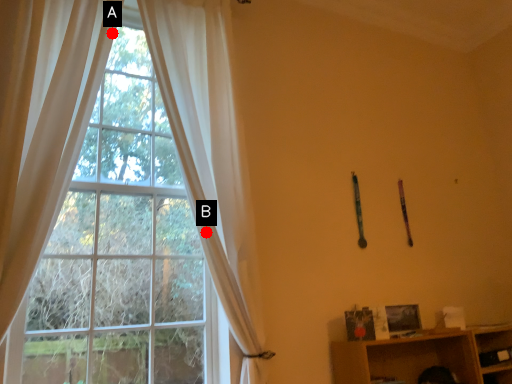
Question: Two points are circled on the image, labeled by A and B beside each circle. Which of the following is the farthest from the observer?

Choices:
 (A) A is further
 (B) B is further

Answer: (A)